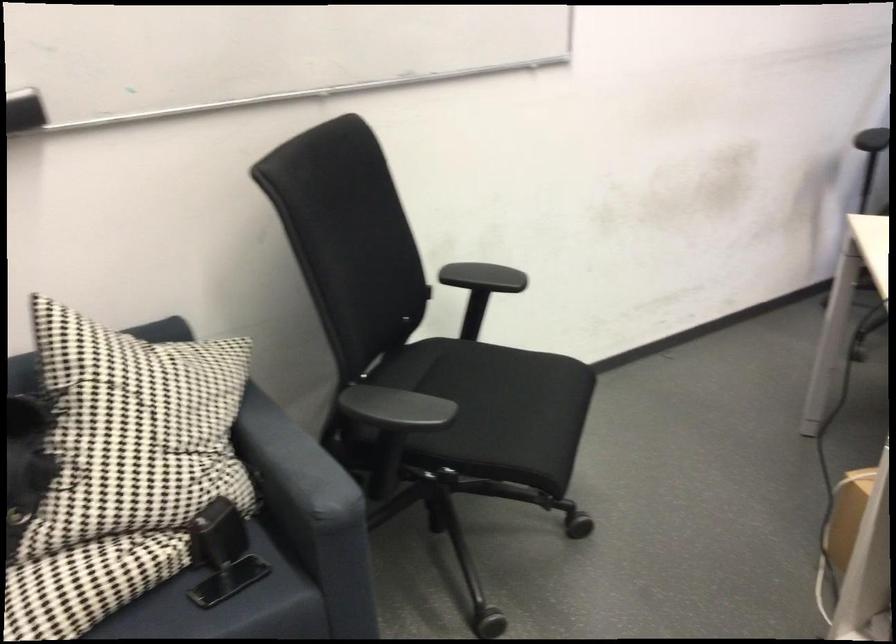
Where would you sit the sofa sitting surface? Please return your answer as a coordinate pair (x, y).

(226, 605)